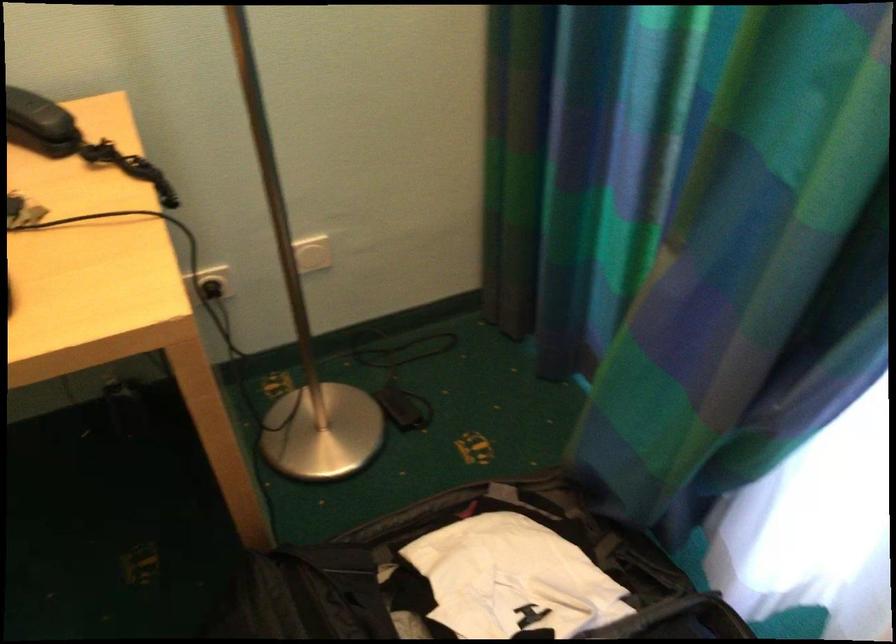
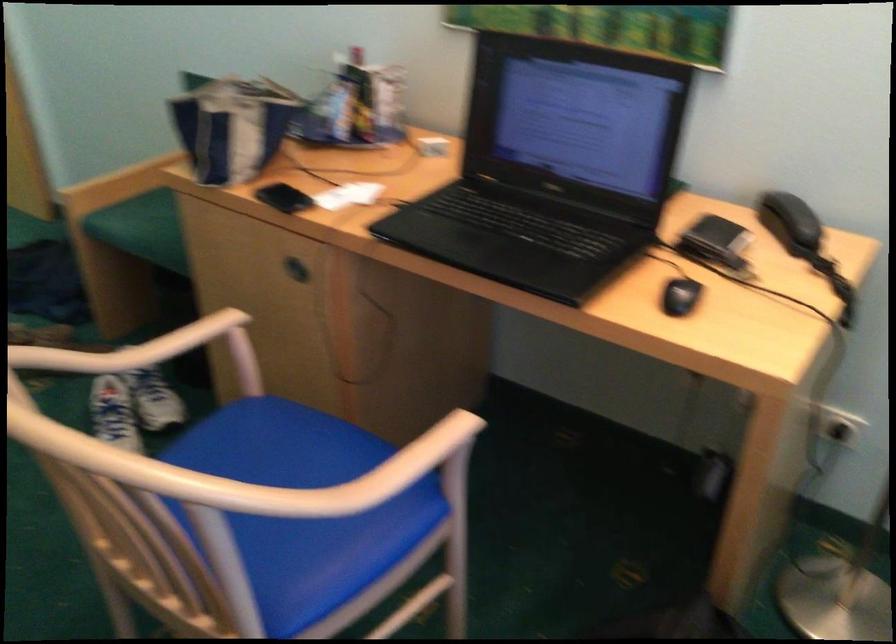
Question: Based on the continuous images, in which direction is the camera rotating? Reply with the corresponding letter.

Choices:
 (A) Left
 (B) Right
 (C) Up
 (D) Down

Answer: (A)